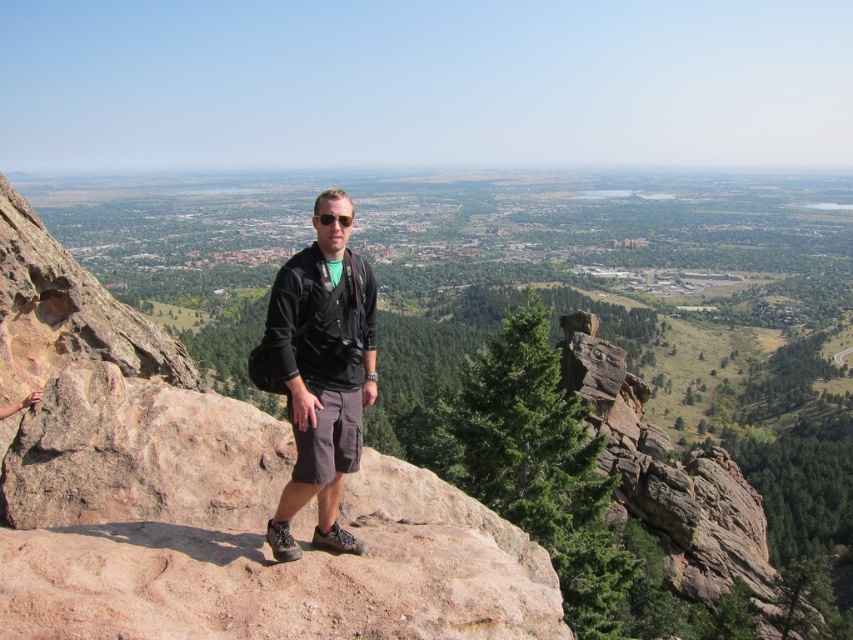
You are a photographer trying to capture the hiker and the rock in the background. Since the brown rough rock at center and the black fabric jacket at center are both in your view, which one would appear larger in your photo?

The brown rough rock at center would appear larger in the photo because it is closer to the viewer than the black fabric jacket at center.

You are a hiker standing at the point marked as point (489, 548). The distance from you to the viewer is 49.59 meters. If you want to move closer to the viewer, which direction should you walk?

To move closer to the viewer from point (489, 548), you should walk towards the direction opposite to where the viewer is located. Since the distance is 49.59 meters, moving towards the viewer would reduce this distance.

You are a photographer trying to capture the hiker in the image. The hiker is wearing a black fabric jacket at center and matte black sunglasses at center. Which object is located to the right of the other?

The black fabric jacket at center is positioned on the right side of matte black sunglasses at center.